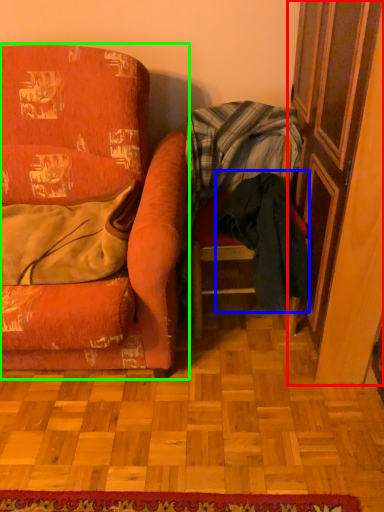
Question: Based on their relative distances, which object is farther from screen door (highlighted by a red box)? Choose from clothing (highlighted by a blue box) and chair (highlighted by a green box).

Choices:
 (A) clothing
 (B) chair

Answer: (B)